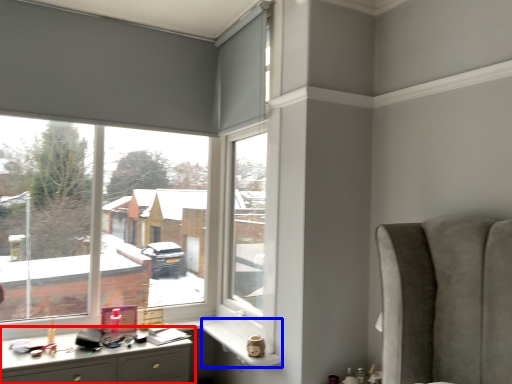
Question: Among these objects, which one is nearest to the camera, desk (highlighted by a red box) or window sill (highlighted by a blue box)?

Choices:
 (A) desk
 (B) window sill

Answer: (A)